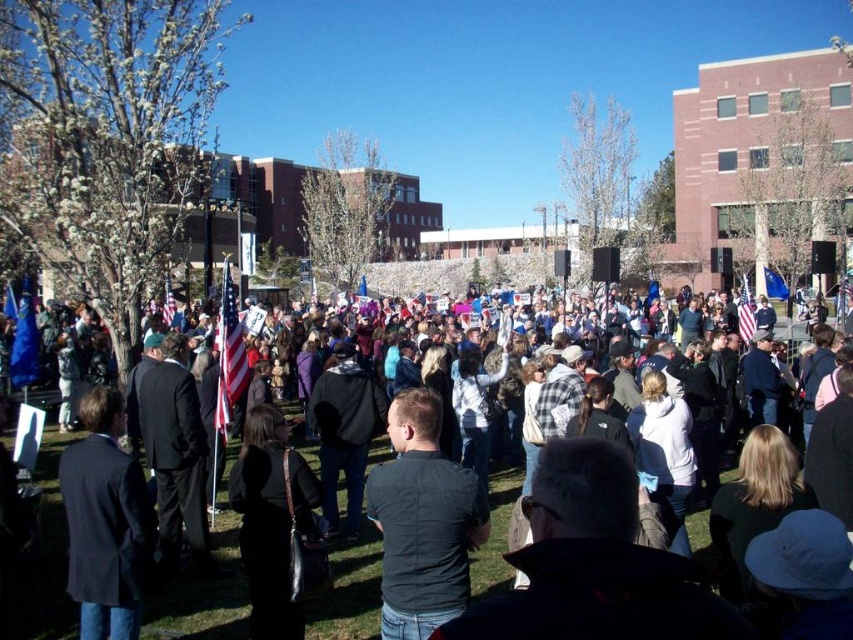
Question: Does dark gray fabric shirt at center appear under american flag at center?

Choices:
 (A) yes
 (B) no

Answer: (A)

Question: Which object is farther from the camera taking this photo?

Choices:
 (A) dark gray fabric shirt at center
 (B) american flag at center
 (C) white cotton shirt at center

Answer: (B)

Question: Which of these objects is positioned closest to the white cotton shirt at center?

Choices:
 (A) american flag at center
 (B) dark gray fabric shirt at center

Answer: (B)

Question: Which object is farther from the camera taking this photo?

Choices:
 (A) american flag at center
 (B) white cotton shirt at center
 (C) dark gray fabric shirt at center

Answer: (A)

Question: Does white cotton shirt at center appear on the right side of dark gray fabric shirt at center?

Choices:
 (A) yes
 (B) no

Answer: (B)

Question: Is the position of dark gray fabric shirt at center more distant than that of american flag at center?

Choices:
 (A) no
 (B) yes

Answer: (A)